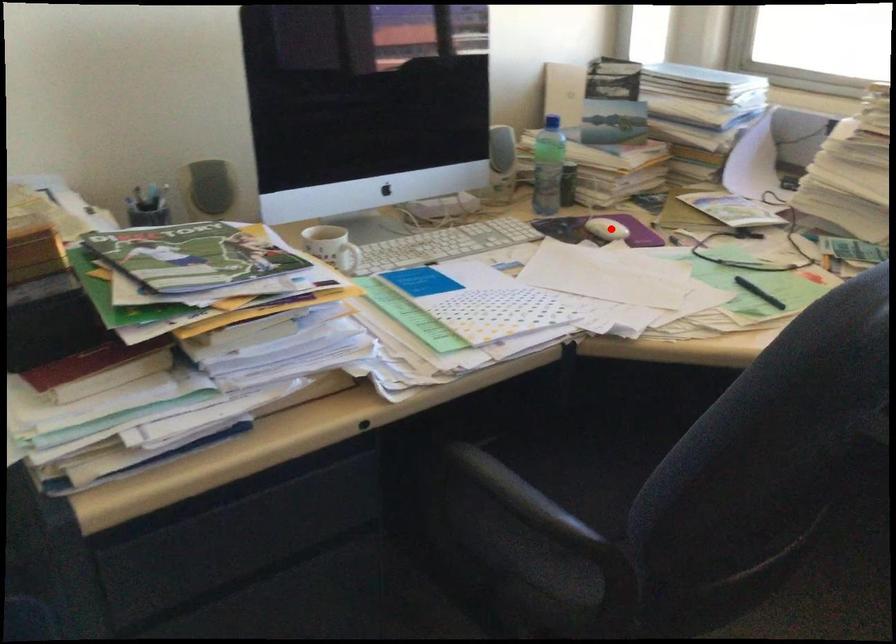
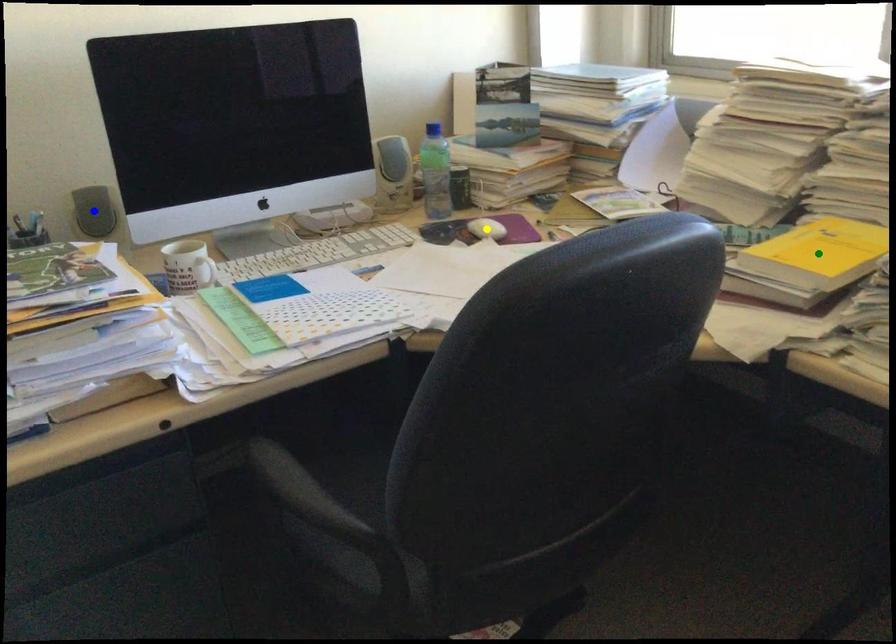
Question: I am providing you with two images of the same scene from different viewpoints. A red point is marked on the first image. You are given multiple points on the second image. Which spot in image 2 lines up with the point in image 1?

Choices:
 (A) blue point
 (B) green point
 (C) yellow point

Answer: (C)